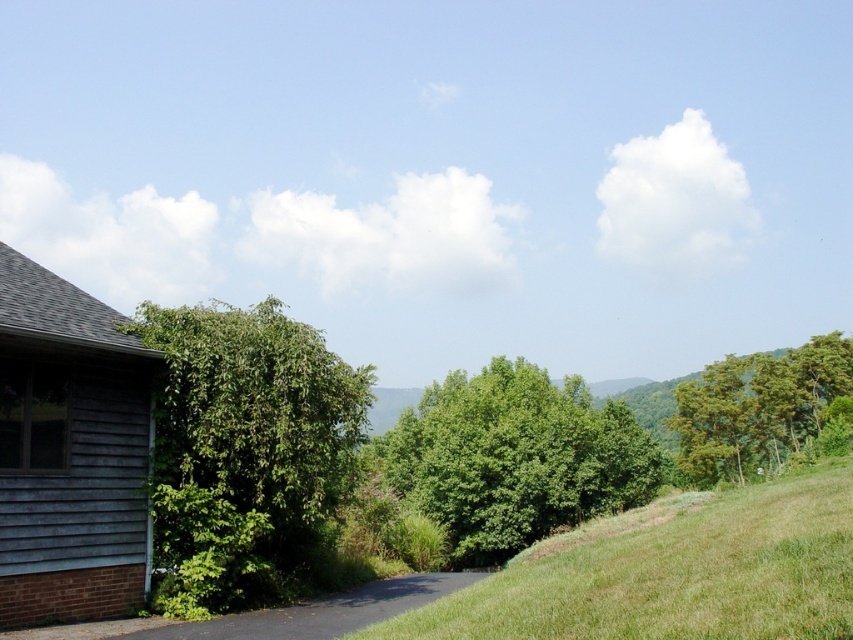
You are standing at the center of the driveway in the image. Which direction should you look to see the green leafy tree at lower left?

The green leafy tree at lower left is located at point 0.706 on the x axis and 0.290 on the y axis, so you should look to the lower left direction to see it.

You are planning to install a garden bench between the green leafy tree at lower left and the green leafy tree at right. The bench requires at least 3 meters of space to be placed comfortably. Based on the scene, can you determine if there is enough space between the two trees for the bench?

The green leafy tree at lower left and green leafy tree at right are 40.81 meters apart from each other, which is more than enough space to comfortably place the garden bench requiring 3 meters.

You are standing at the edge of the driveway and want to walk to the green leafy tree at center. Which direction should you go to avoid the green grassy hillside at lower right?

To reach the green leafy tree at center while avoiding the green grassy hillside at lower right, you should head towards the center of the image instead of the lower right direction, since the green grassy hillside at lower right is smaller than the green leafy tree at center and might be easier to bypass.